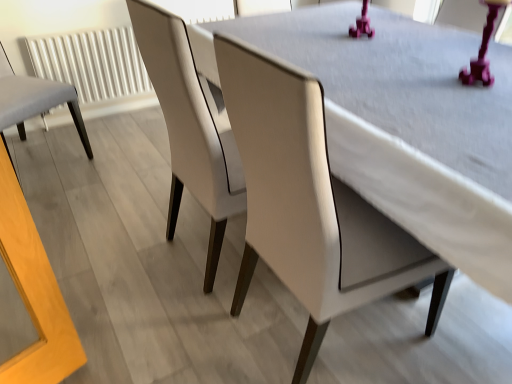
What are the coordinates of `vacant area that lies to the right of light gray fabric chair at left, the 1th chair in the left-to-right sequence` in the screenshot? It's located at (110, 178).